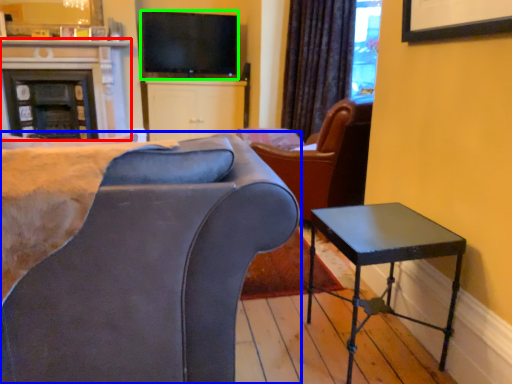
Question: Which object is the farthest from fireplace (highlighted by a red box)? Choose among these: chair (highlighted by a blue box) or television (highlighted by a green box).

Choices:
 (A) chair
 (B) television

Answer: (A)